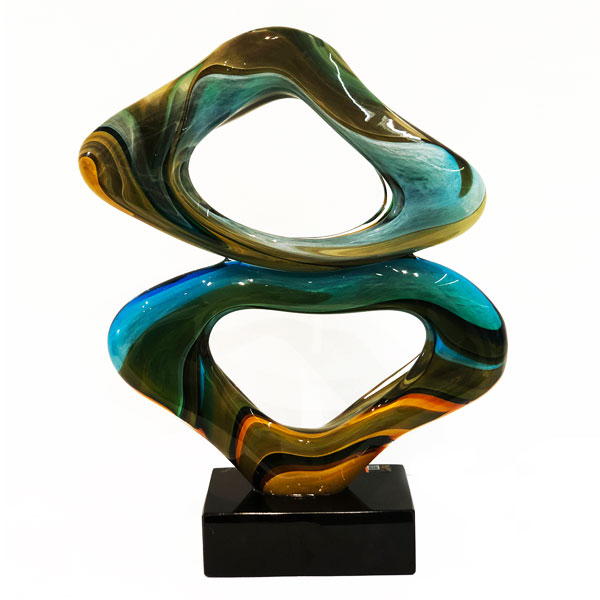
Identify the location of bottom ring of ceramic artwork. This screenshot has height=600, width=600. (483, 315).